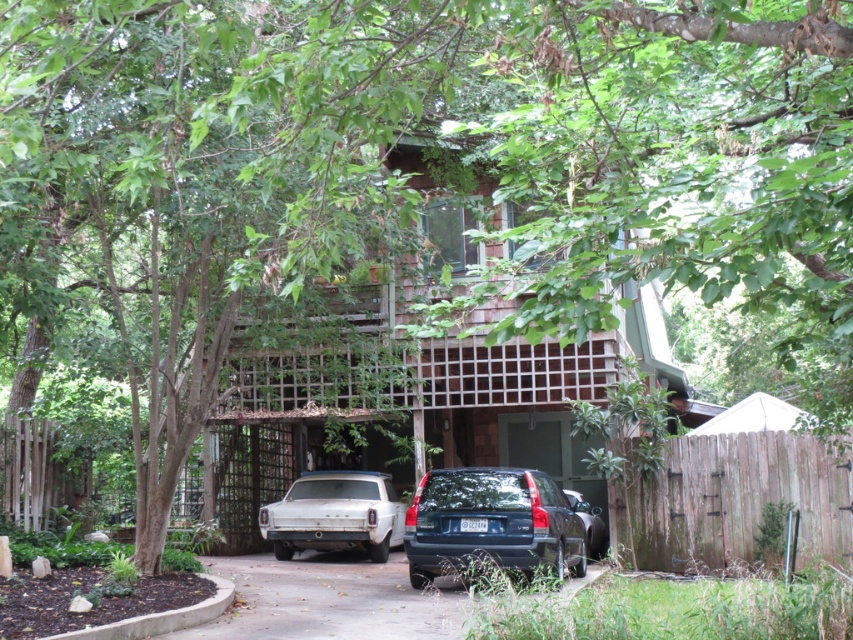
Question: Does matte dark blue suv at center appear on the right side of white matte sedan at lower left?

Choices:
 (A) yes
 (B) no

Answer: (A)

Question: Which object is farther from the camera taking this photo?

Choices:
 (A) matte dark blue suv at center
 (B) white matte sedan at lower left
 (C) concrete driveway at center

Answer: (B)

Question: Which object is positioned farthest from the white matte sedan at lower left?

Choices:
 (A) matte dark blue suv at center
 (B) concrete driveway at center

Answer: (A)

Question: Does concrete driveway at center have a larger size compared to matte dark blue suv at center?

Choices:
 (A) yes
 (B) no

Answer: (A)

Question: Is concrete driveway at center below white matte sedan at lower left?

Choices:
 (A) yes
 (B) no

Answer: (A)

Question: Which object appears farthest from the camera in this image?

Choices:
 (A) white matte sedan at lower left
 (B) matte dark blue suv at center

Answer: (A)